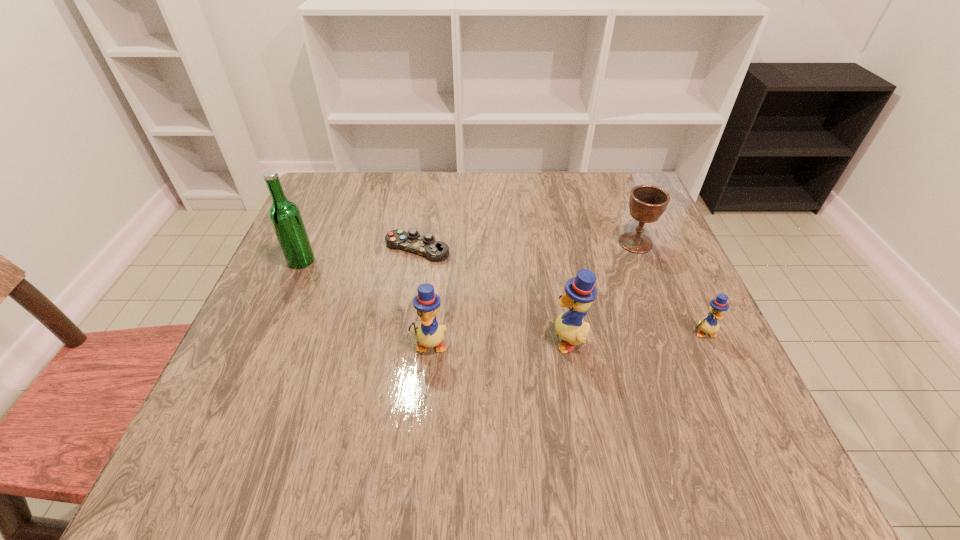
What are the coordinates of `vacant area that lies between the chalice and the leftmost duckling` in the screenshot? It's located at pos(533,294).

This screenshot has height=540, width=960. Find the location of `free point between the control and the tallest object`. free point between the control and the tallest object is located at coordinates (359, 255).

Where is `free point between the fifth object from left to right and the fourth object from left to right`? The image size is (960, 540). free point between the fifth object from left to right and the fourth object from left to right is located at coordinates (602, 291).

Where is `vacant area that lies between the leftmost object and the second object from right to left`? This screenshot has height=540, width=960. vacant area that lies between the leftmost object and the second object from right to left is located at coordinates [x=468, y=252].

At what (x,y) coordinates should I click in order to perform the action: click on free spot between the second shortest duckling and the second object from right to left. Please return your answer as a coordinate pair (x, y). The height and width of the screenshot is (540, 960). Looking at the image, I should click on [533, 294].

Find the location of a particular element. This screenshot has height=540, width=960. unoccupied position between the beer bottle and the shortest object is located at coordinates (359, 255).

Select which object is the fifth closest to the second duckling from left to right. Please provide its 2D coordinates. Your answer should be formatted as a tuple, i.e. [(x, y)], where the tuple contains the x and y coordinates of a point satisfying the conditions above.

[(285, 217)]

Locate which object ranks fifth in proximity to the chalice. Please provide its 2D coordinates. Your answer should be formatted as a tuple, i.e. [(x, y)], where the tuple contains the x and y coordinates of a point satisfying the conditions above.

[(285, 217)]

Locate which duckling is the second closest to the control. Please provide its 2D coordinates. Your answer should be formatted as a tuple, i.e. [(x, y)], where the tuple contains the x and y coordinates of a point satisfying the conditions above.

[(580, 292)]

Select which duckling is the closest to the beer bottle. Please provide its 2D coordinates. Your answer should be formatted as a tuple, i.e. [(x, y)], where the tuple contains the x and y coordinates of a point satisfying the conditions above.

[(429, 334)]